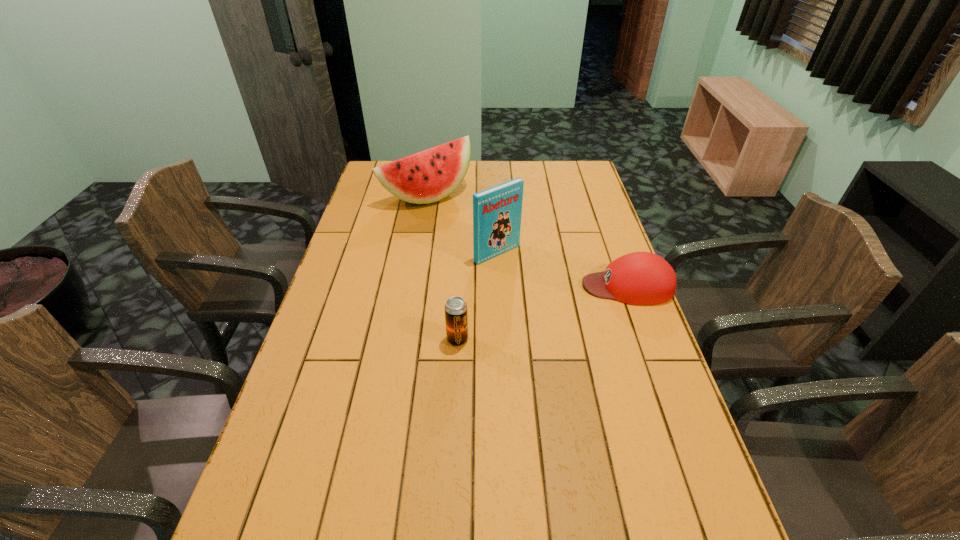
Identify the location of vacant area situated 0.150m on the front-facing side of the shortest object. (533, 286).

This screenshot has height=540, width=960. I want to click on free location located 0.200m on the front-facing side of the shortest object, so click(516, 286).

In order to click on vacant area situated on the outer rind of the third shortest object in this screenshot , I will do `click(460, 216)`.

This screenshot has height=540, width=960. In order to click on vacant space located 0.150m on the outer rind of the third shortest object in this screenshot , I will do `click(474, 228)`.

You are a GUI agent. You are given a task and a screenshot of the screen. Output one action in this format:
    pyautogui.click(x=<x>, y=<y>)
    Task: Click on the free space located 0.050m on the outer rind of the third shortest object
    
    Given the screenshot: What is the action you would take?
    pyautogui.click(x=459, y=215)

Find the location of a particular element. vacant space situated on the front cover of the book is located at coordinates (531, 280).

The height and width of the screenshot is (540, 960). Identify the location of free location located on the front cover of the book. (521, 271).

This screenshot has height=540, width=960. What are the coordinates of `blank area located on the front cover of the book` in the screenshot? It's located at (529, 278).

I want to click on object at the far edge, so click(429, 176).

This screenshot has height=540, width=960. Identify the location of object located at the left edge. (429, 176).